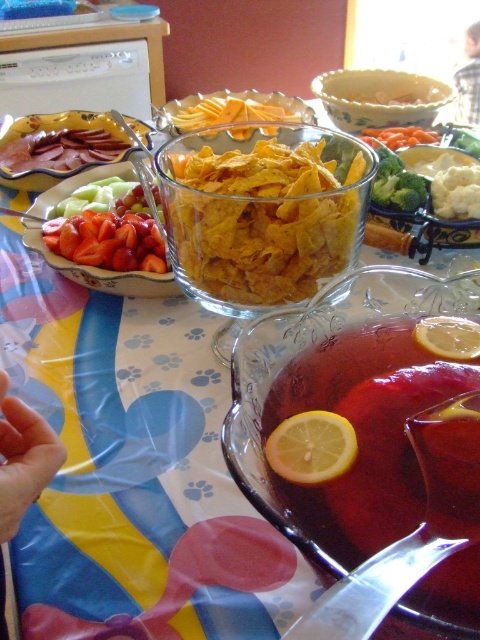
Question: Does yellow matte lemon at lower center have a smaller size compared to white creamy mashed potatoes at center?

Choices:
 (A) no
 (B) yes

Answer: (B)

Question: Does translucent glass punch bowl at center have a larger size compared to yellow matte lemon at center?

Choices:
 (A) yes
 (B) no

Answer: (A)

Question: Which point is farther to the camera?

Choices:
 (A) matte brown meat at upper left
 (B) yellow matte lemon at center
 (C) translucent glass punch bowl at center

Answer: (A)

Question: Among these points, which one is nearest to the camera?

Choices:
 (A) (464, 170)
 (B) (456, 118)
 (C) (408, 145)
 (D) (456, 348)

Answer: (D)

Question: Which object appears farthest from the camera in this image?

Choices:
 (A) skinny hand at lower left
 (B) translucent glass punch bowl at center

Answer: (A)

Question: Can you confirm if translucent glass punch bowl at center is positioned below white creamy mashed potatoes at center?

Choices:
 (A) no
 (B) yes

Answer: (B)